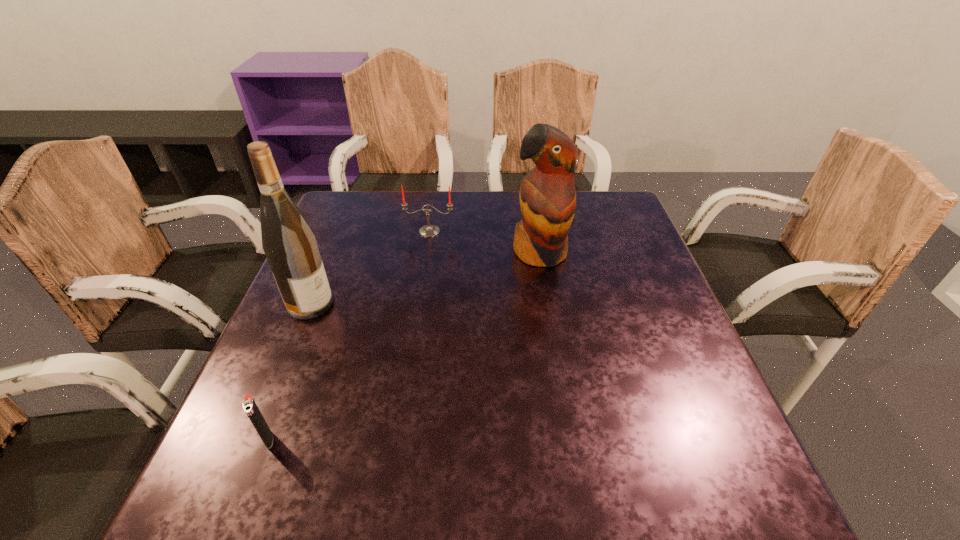
This screenshot has height=540, width=960. What are the coordinates of `the second nearest object` in the screenshot? It's located at (289, 243).

The height and width of the screenshot is (540, 960). Identify the location of the rightmost object. (547, 196).

This screenshot has width=960, height=540. In order to click on the second shortest object in this screenshot , I will do `click(428, 230)`.

The width and height of the screenshot is (960, 540). I want to click on candle, so click(x=428, y=230).

Where is `the nearest object`? This screenshot has width=960, height=540. the nearest object is located at coordinates (249, 405).

Find the location of a particular element. This screenshot has width=960, height=540. igniter is located at coordinates (249, 405).

I want to click on free location located 0.130m on the back of the wine bottle, so click(x=330, y=255).

This screenshot has height=540, width=960. What are the coordinates of `vacant area situated on the face of the parrot` in the screenshot? It's located at (565, 408).

Identify the location of vacant space situated on the front-facing side of the candle. (422, 278).

The height and width of the screenshot is (540, 960). I want to click on free space located 0.110m on the front of the nearest object, so click(x=238, y=517).